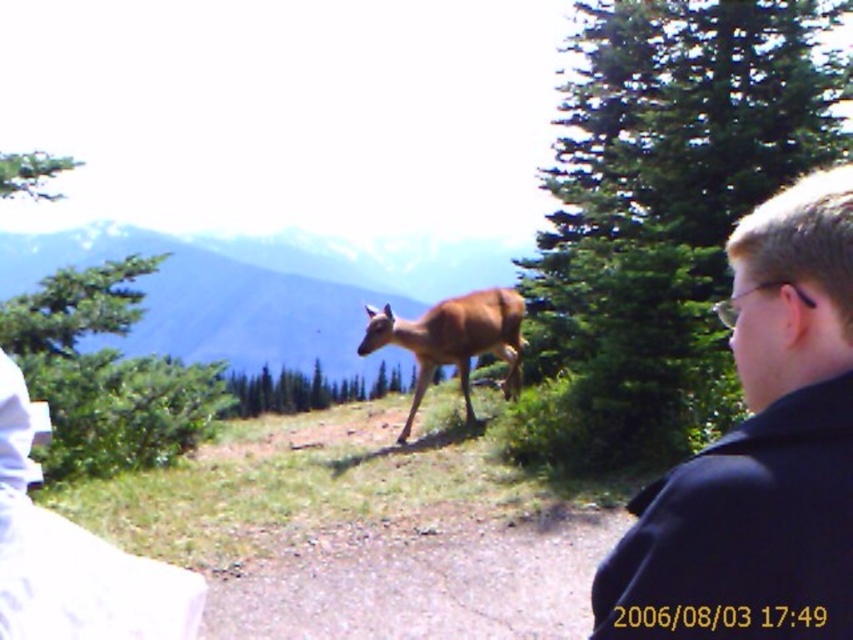
Can you confirm if green textured pine at upper right is wider than dark blue jacket at right?

Indeed, green textured pine at upper right has a greater width compared to dark blue jacket at right.

Does green textured pine at upper right have a larger size compared to dark blue jacket at right?

Yes, green textured pine at upper right is bigger than dark blue jacket at right.

Locate an element on the screen. green textured pine at upper right is located at coordinates (662, 212).

This screenshot has height=640, width=853. Find the location of `green textured pine at upper right`. green textured pine at upper right is located at coordinates (662, 212).

Which is in front, point (235, 243) or point (399, 333)?

Positioned in front is point (399, 333).

Who is positioned more to the right, brown fur deer at center or brown matte deer at center?

Positioned to the right is brown matte deer at center.

The width and height of the screenshot is (853, 640). Identify the location of brown fur deer at center. (223, 298).

Identify the location of brown fur deer at center. (223, 298).

Is green textured pine at upper right taller than brown matte deer at center?

Correct, green textured pine at upper right is much taller as brown matte deer at center.

Who is higher up, green textured pine at upper right or brown matte deer at center?

green textured pine at upper right

Find the location of `green textured pine at upper right`. green textured pine at upper right is located at coordinates (662, 212).